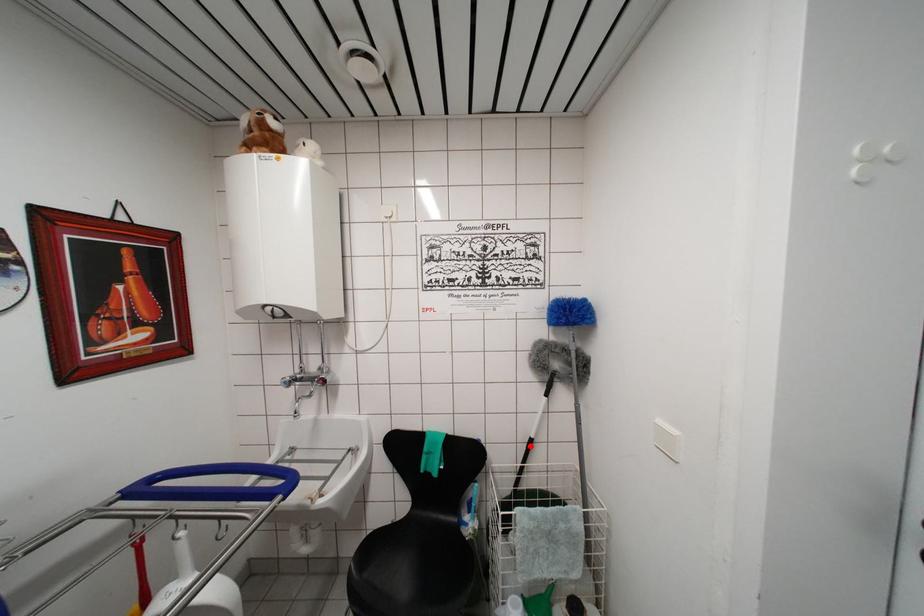
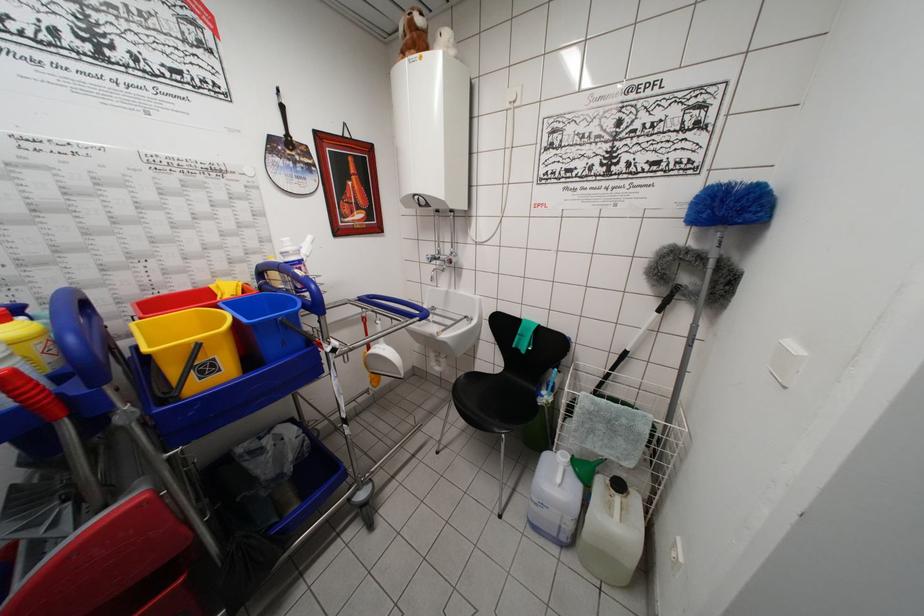
In the second image, find the point that corresponds to the highlighted location in the first image.

(624, 358)